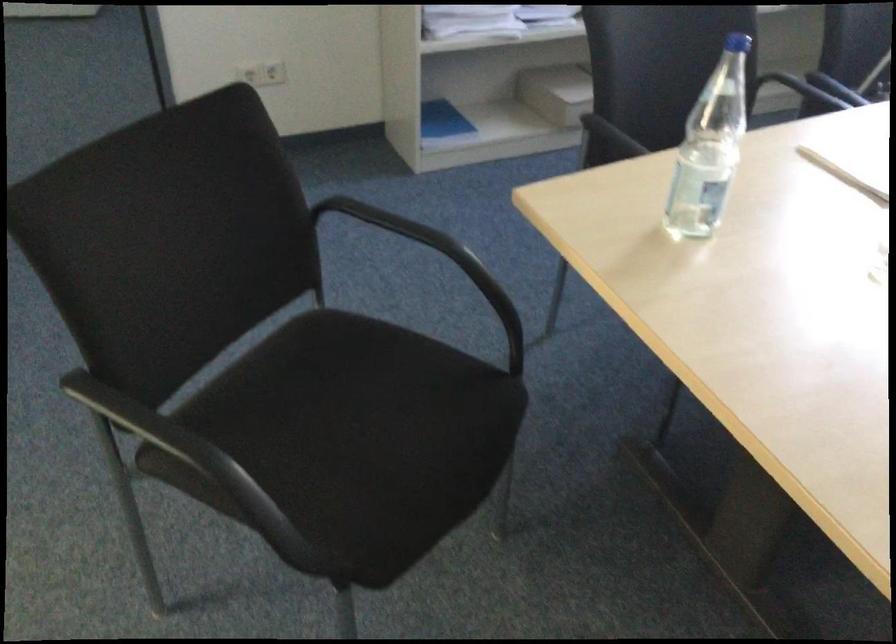
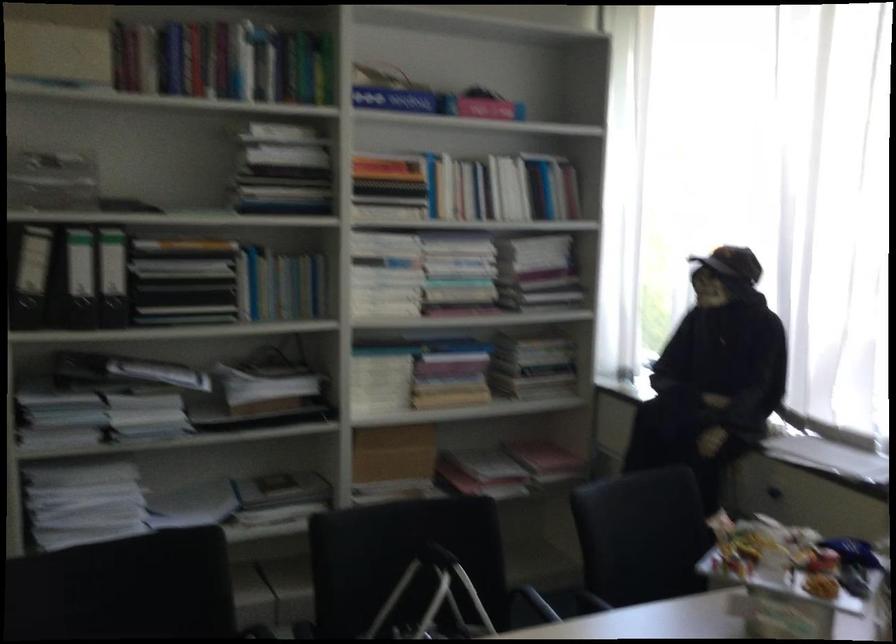
Question: Which direction would the cameraman need to move to produce the second image? Reply with the corresponding letter.

Choices:
 (A) Left
 (B) Right
 (C) Forward
 (D) Backward

Answer: (B)